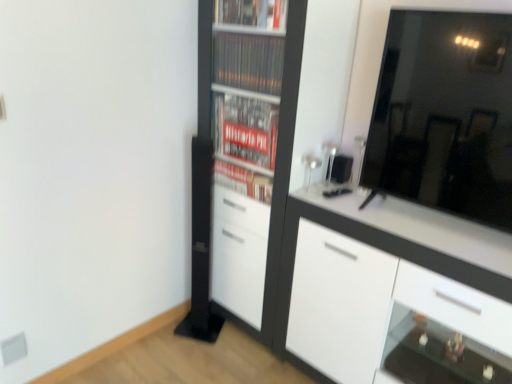
Where is `free space to the left of black glossy mirror at upper right`? free space to the left of black glossy mirror at upper right is located at coordinates (357, 215).